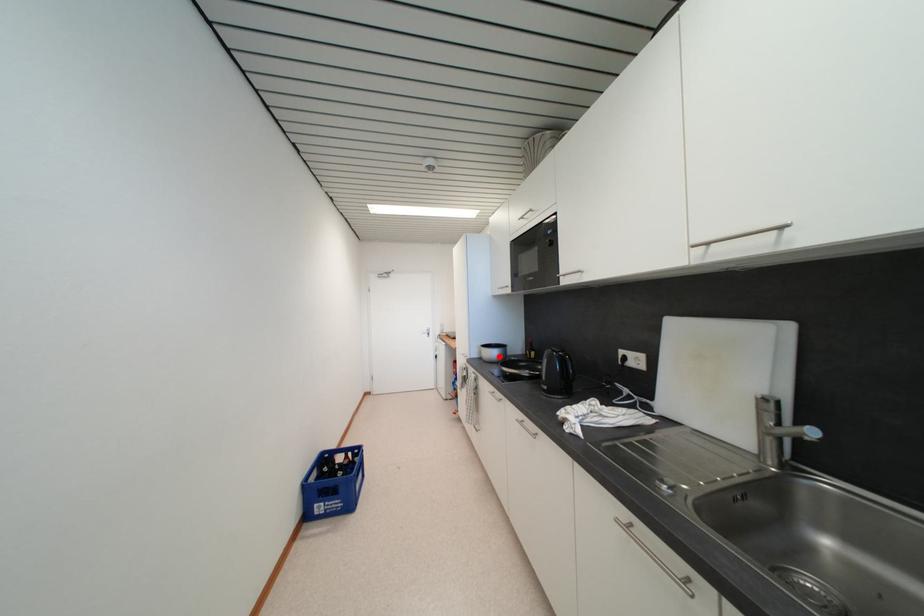
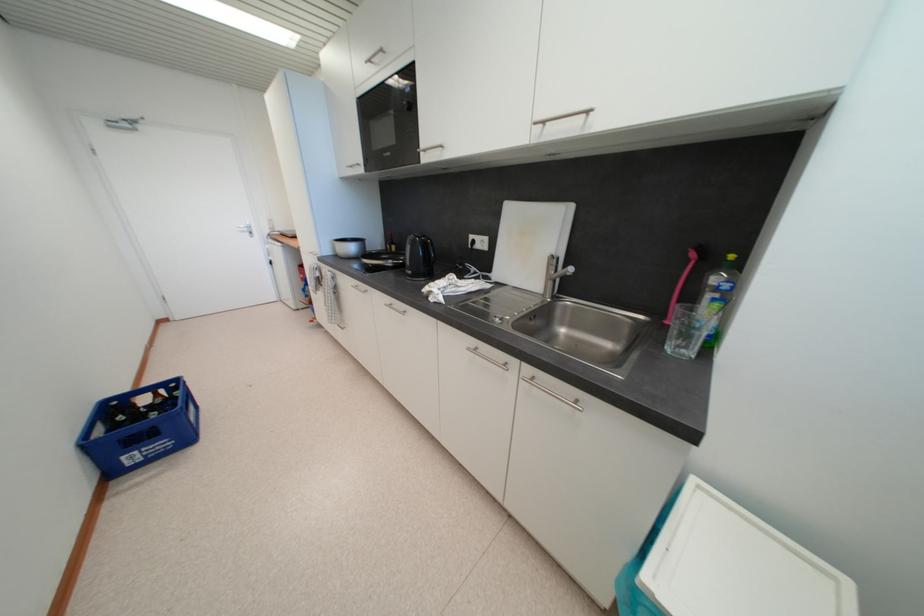
The point at the highlighted location is marked in the first image. Where is the corresponding point in the second image?

(357, 251)